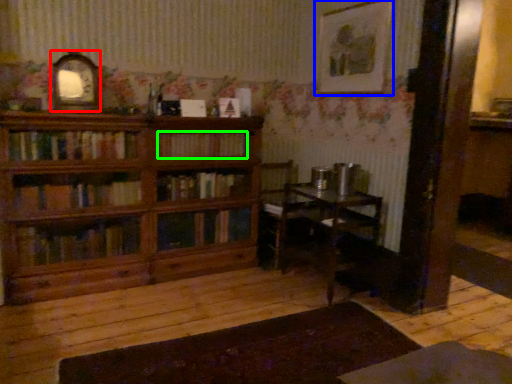
Question: Based on their relative distances, which object is nearer to picture frame (highlighted by a red box)? Choose from picture frame (highlighted by a blue box) and book (highlighted by a green box).

Choices:
 (A) picture frame
 (B) book

Answer: (B)